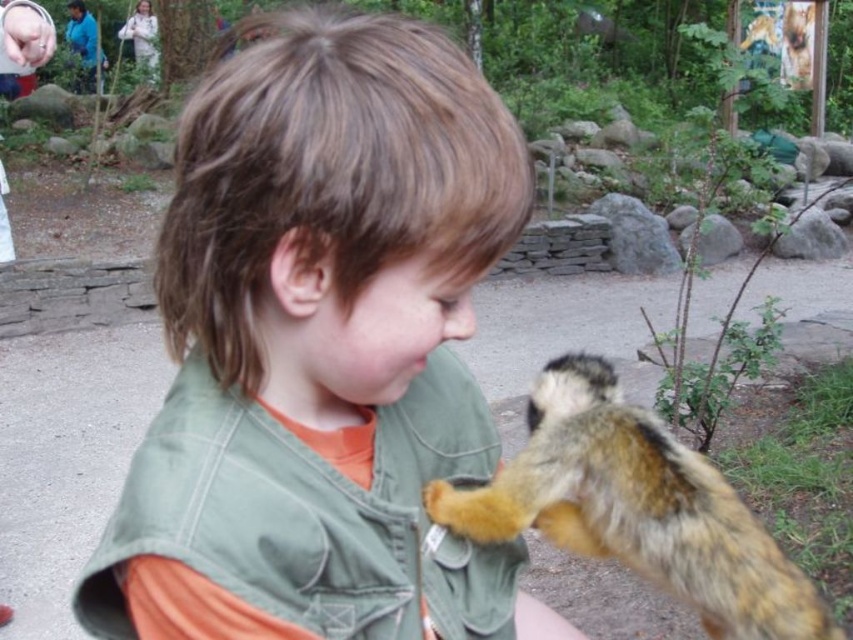
Question: Is green fabric shirt at center bigger than fuzzy brown squirrel at lower right?

Choices:
 (A) no
 (B) yes

Answer: (B)

Question: Observing the image, what is the correct spatial positioning of green fabric shirt at center in reference to fuzzy brown squirrel at lower right?

Choices:
 (A) left
 (B) right

Answer: (A)

Question: Which of the following is the farthest from the observer?

Choices:
 (A) (460, 513)
 (B) (312, 164)

Answer: (A)

Question: Observing the image, what is the correct spatial positioning of green fabric shirt at center in reference to fuzzy brown squirrel at lower right?

Choices:
 (A) right
 (B) left

Answer: (B)